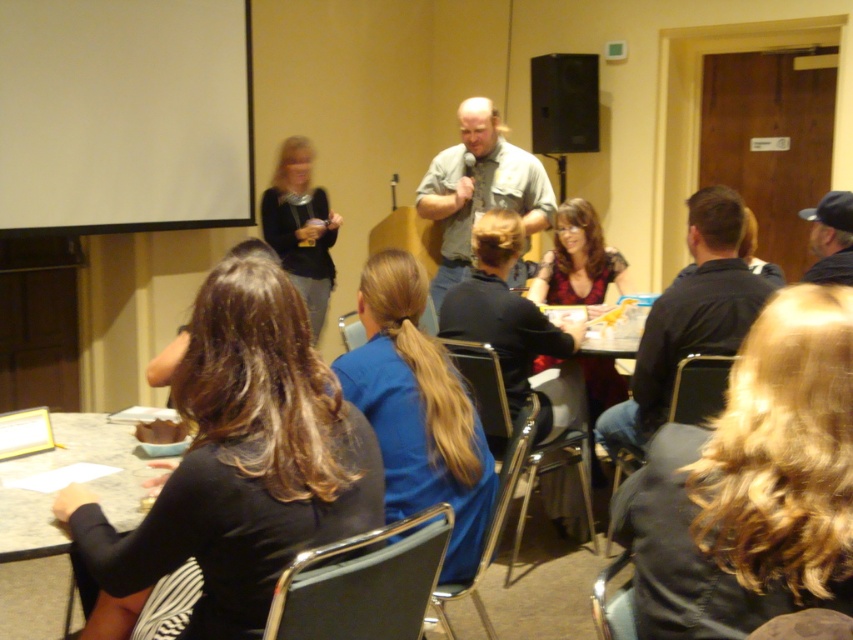
Is point (33, 17) farther from camera compared to point (686, 300)?

Yes, it is behind point (686, 300).

Is point (131, 88) positioned before point (639, 403)?

No, (131, 88) is behind (639, 403).

Image resolution: width=853 pixels, height=640 pixels. I want to click on white matte projection screen at upper left, so click(x=125, y=115).

Who is lower down, white matte projection screen at upper left or smooth white table at lower left?

Positioned lower is smooth white table at lower left.

Which is in front, point (12, 141) or point (51, 620)?

Point (51, 620) is in front.

You are a GUI agent. You are given a task and a screenshot of the screen. Output one action in this format:
    pyautogui.click(x=<x>, y=<y>)
    Task: Click on the white matte projection screen at upper left
    This screenshot has width=853, height=640.
    Given the screenshot: What is the action you would take?
    pyautogui.click(x=125, y=115)

Between point (663, 342) and point (117, 428), which one is positioned in front?

Positioned in front is point (117, 428).

Is black shirt at center further to the viewer compared to smooth white table at lower left?

Yes.

Is point (711, 298) farther from viewer compared to point (41, 518)?

Yes, point (711, 298) is behind point (41, 518).

Locate an element on the screen. black shirt at center is located at coordinates (689, 317).